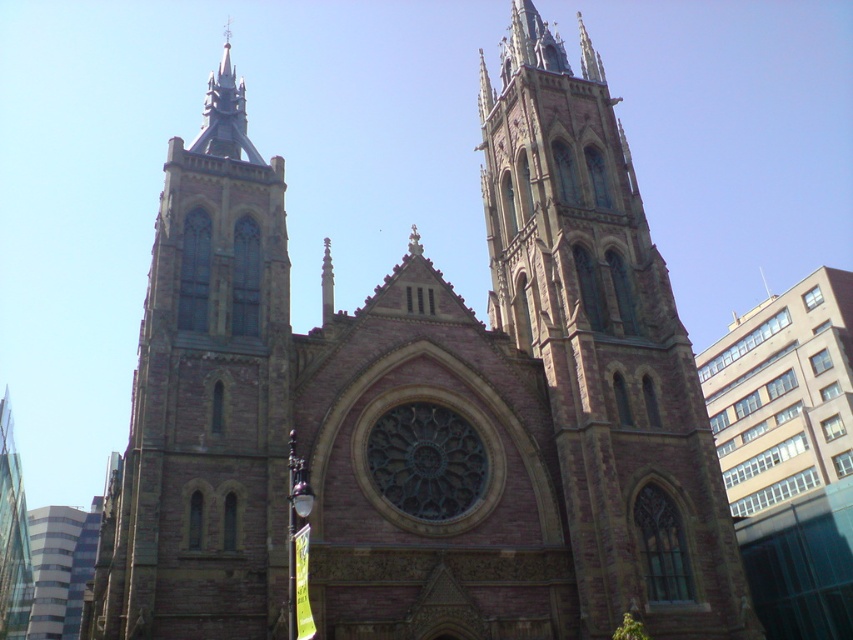
Can you confirm if brown stone tower at left is positioned below transparent glass tower at left?

Incorrect, brown stone tower at left is not positioned below transparent glass tower at left.

Between brown stone tower at left and transparent glass tower at left, which one appears on the left side from the viewer's perspective?

From the viewer's perspective, transparent glass tower at left appears more on the left side.

Between point (195, 259) and point (9, 593), which one is positioned in front?

Point (195, 259) is in front.

Locate an element on the screen. Image resolution: width=853 pixels, height=640 pixels. brown stone tower at left is located at coordinates (206, 403).

Does brown stone tower at center have a greater height compared to brown stone tower at left?

No, brown stone tower at center is not taller than brown stone tower at left.

Does brown stone tower at center appear on the right side of brown stone tower at left?

Yes, brown stone tower at center is to the right of brown stone tower at left.

Between point (692, 403) and point (236, 269), which one is positioned behind?

The point (692, 403) is more distant.

Image resolution: width=853 pixels, height=640 pixels. What are the coordinates of `brown stone tower at center` in the screenshot? It's located at (602, 348).

Between brown stone tower at center and transparent glass tower at left, which one appears on the left side from the viewer's perspective?

transparent glass tower at left is more to the left.

Based on the photo, can you confirm if brown stone tower at center is smaller than transparent glass tower at left?

Yes.

Who is more forward, (550, 211) or (28, 605)?

Positioned in front is point (550, 211).

Identify the location of brown stone tower at center. (602, 348).